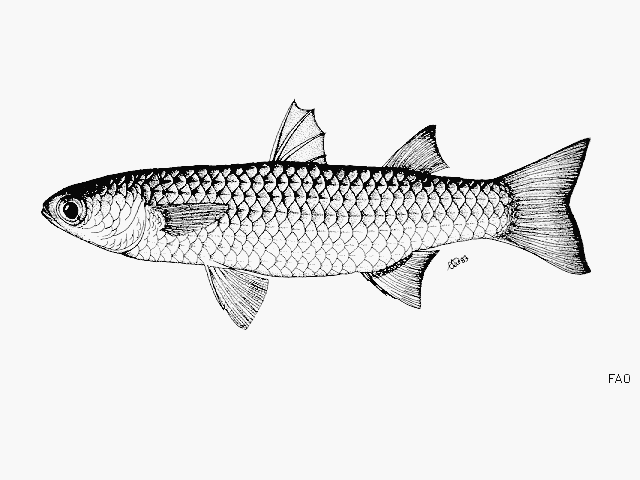
This screenshot has width=640, height=480. Find the location of `scales`. scales is located at coordinates (328, 214), (344, 215), (353, 212), (342, 232), (329, 231), (321, 231), (307, 228), (301, 213), (292, 212), (296, 236).